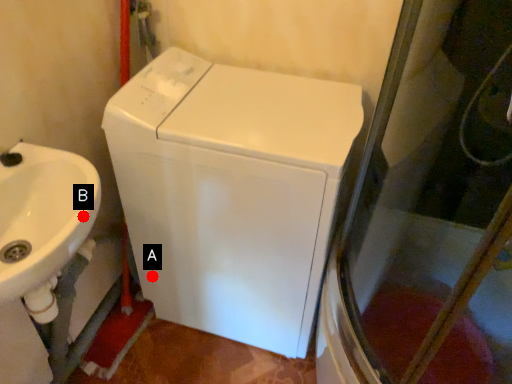
Question: Two points are circled on the image, labeled by A and B beside each circle. Among these points, which one is nearest to the camera?

Choices:
 (A) A is closer
 (B) B is closer

Answer: (B)